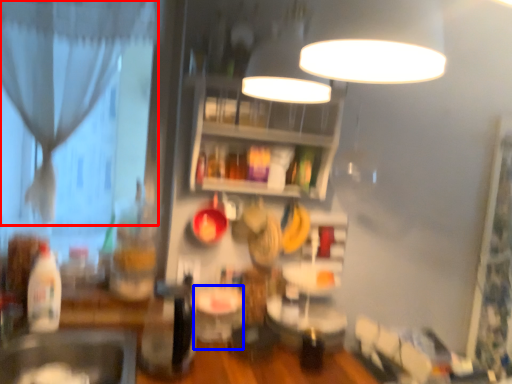
Question: Which object appears farthest to the camera in this image, curtain (highlighted by a red box) or table (highlighted by a blue box)?

Choices:
 (A) curtain
 (B) table

Answer: (A)